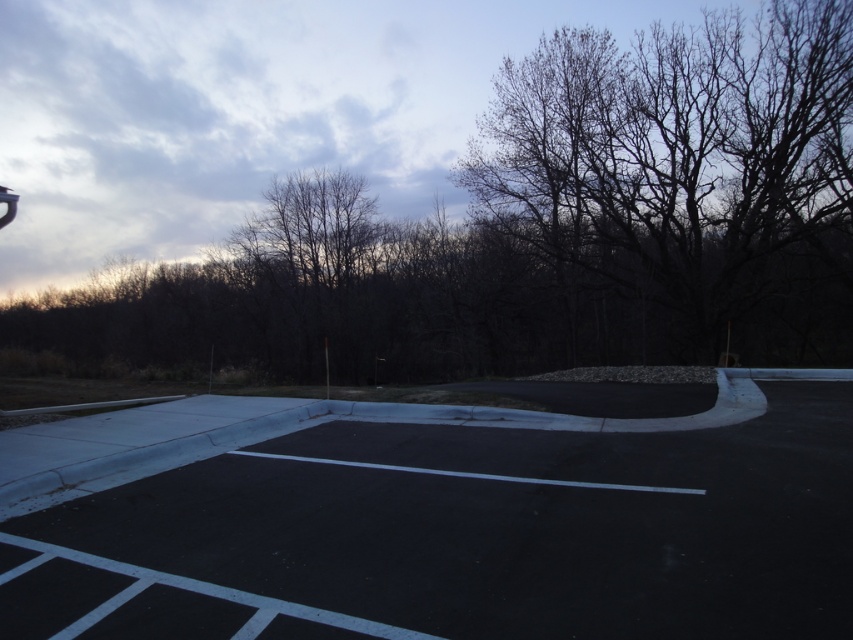
Is black asphalt parking lot at center to the right of bare branches at upper right from the viewer's perspective?

No, black asphalt parking lot at center is not to the right of bare branches at upper right.

Find the location of a particular element. The height and width of the screenshot is (640, 853). black asphalt parking lot at center is located at coordinates (467, 534).